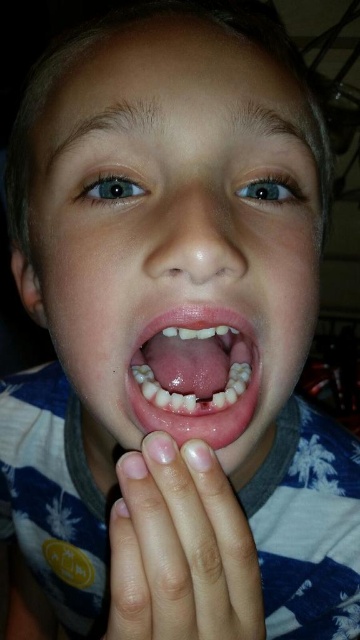
Who is positioned more to the right, smooth skin face at center or pink flesh-colored teeth at center?

From the viewer's perspective, pink flesh-colored teeth at center appears more on the right side.

Where is `smooth skin face at center`? The height and width of the screenshot is (640, 360). smooth skin face at center is located at coordinates (176, 234).

Is point (203, 104) closer to camera compared to point (185, 413)?

No, (203, 104) is further to viewer.

Identify the location of smooth skin face at center. This screenshot has height=640, width=360. (176, 234).

Between point (181, 198) and point (196, 618), which one is positioned in front?

Point (196, 618) is in front.

Measure the distance between smooth skin face at center and smooth skin hand at lower center.

smooth skin face at center is 5.32 inches away from smooth skin hand at lower center.

Locate an element on the screen. This screenshot has width=360, height=640. smooth skin face at center is located at coordinates (176, 234).

Who is taller, smooth skin hand at lower center or pink flesh-colored teeth at center?

smooth skin hand at lower center is taller.

Which is more to the left, smooth skin hand at lower center or pink flesh-colored teeth at center?

Positioned to the left is smooth skin hand at lower center.

The width and height of the screenshot is (360, 640). What are the coordinates of `smooth skin hand at lower center` in the screenshot? It's located at (181, 548).